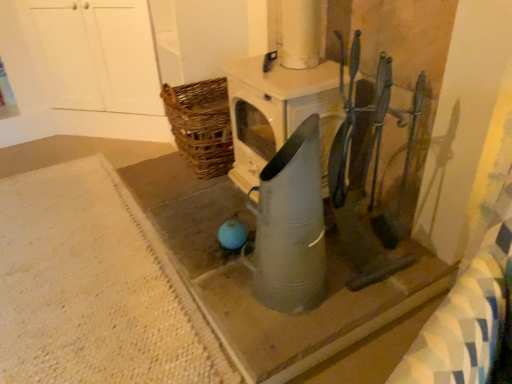
Where is `free point above white textured rug at lower left, which is counted as the first concrete, starting from the left (from a real-world perspective)`? free point above white textured rug at lower left, which is counted as the first concrete, starting from the left (from a real-world perspective) is located at coordinates (68, 265).